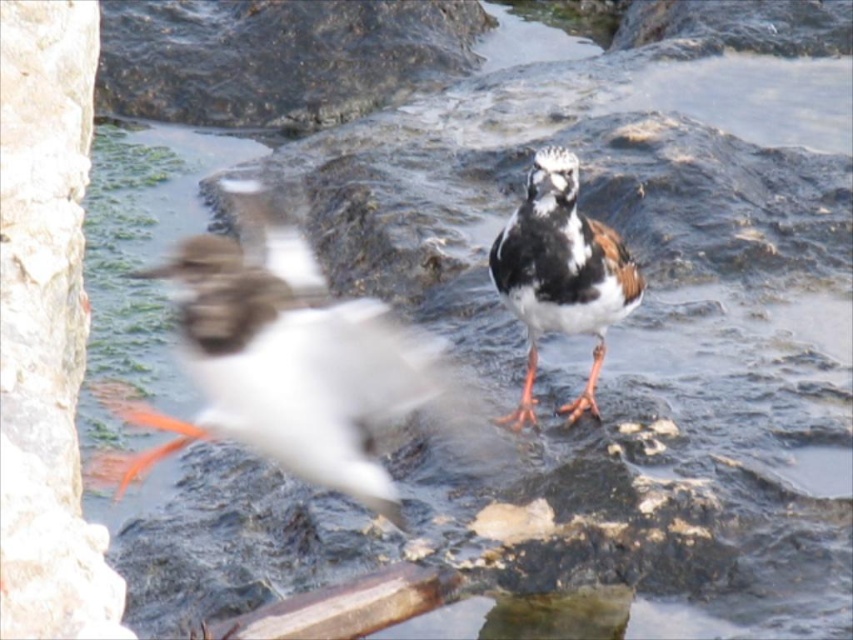
You are standing at the origin point of the image. You see a point marked at coordinates point (286, 362). What object is located at that point?

The point (286, 362) corresponds to the white glossy bird at center.